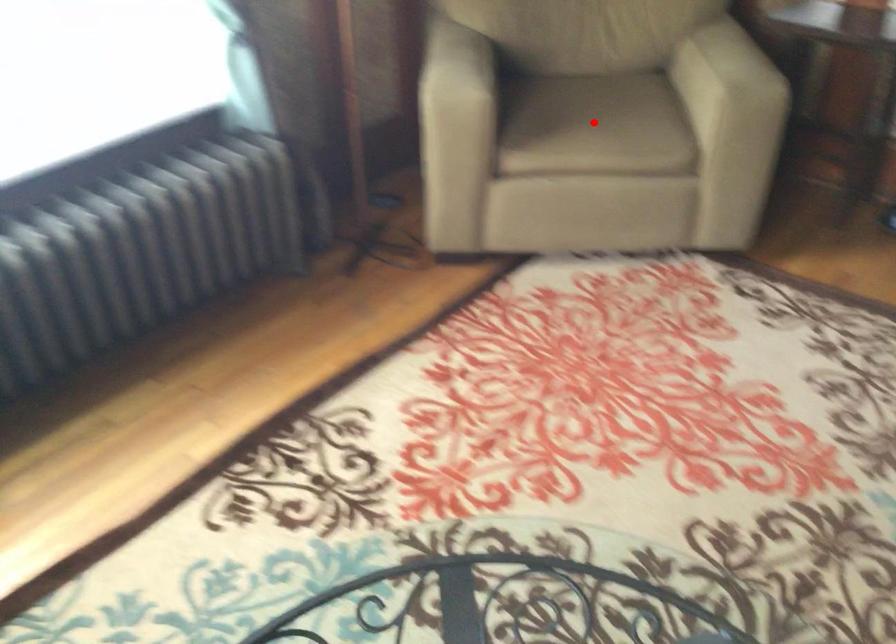
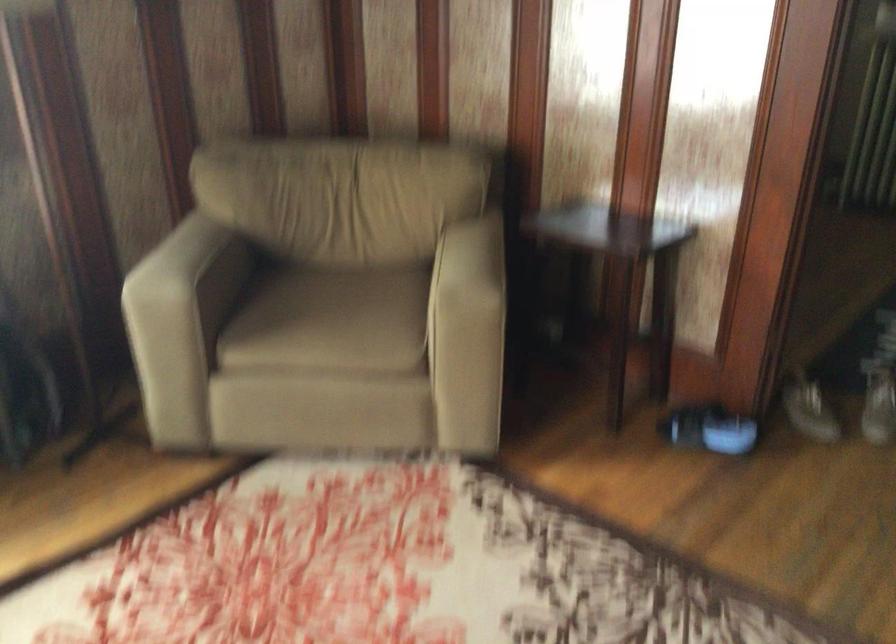
Find the pixel in the second image that matches the highlighted location in the first image.

(331, 321)